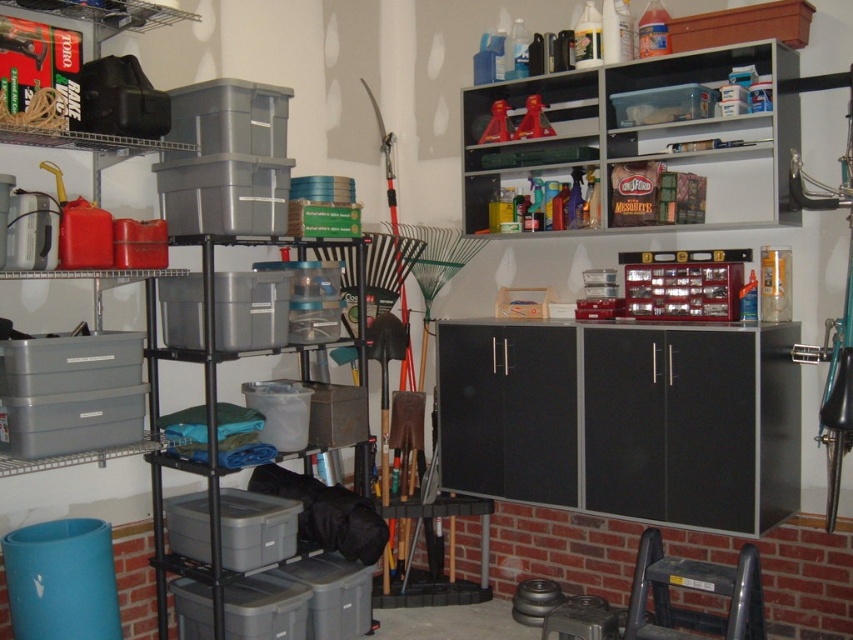
Between matte plastic shelf at upper center and gray plastic bins at left, which one appears on the right side from the viewer's perspective?

From the viewer's perspective, matte plastic shelf at upper center appears more on the right side.

Where is `matte plastic shelf at upper center`? matte plastic shelf at upper center is located at coordinates (637, 141).

Which is in front, point (628, 65) or point (9, 157)?

Point (9, 157) is in front.

The image size is (853, 640). I want to click on matte plastic shelf at upper center, so click(x=637, y=141).

Measure the distance between point [498,150] and camera.

The distance of point [498,150] from camera is 3.63 meters.

Who is positioned more to the left, matte plastic shelf at upper center or gray plastic shelves at center left?

gray plastic shelves at center left is more to the left.

The width and height of the screenshot is (853, 640). Identify the location of matte plastic shelf at upper center. (637, 141).

Who is more distant from viewer, (112, 188) or (215, 493)?

The point (112, 188) is more distant.

Can you confirm if gray plastic bins at left is shorter than gray plastic shelves at center left?

Yes, gray plastic bins at left is shorter than gray plastic shelves at center left.

Is point (51, 269) closer to viewer compared to point (314, 243)?

Yes, it is.

Image resolution: width=853 pixels, height=640 pixels. In order to click on gray plastic bins at left in this screenshot , I will do `click(80, 163)`.